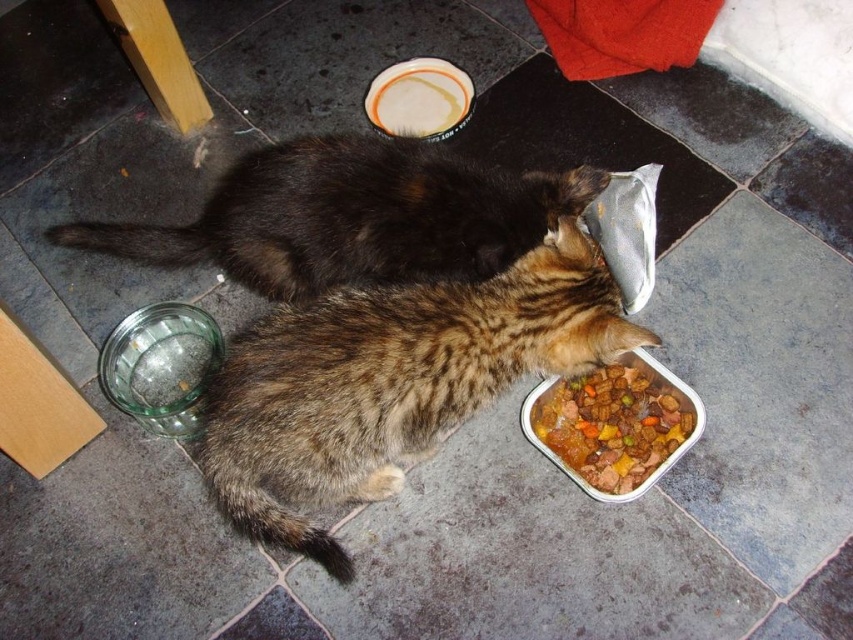
Question: Is dark brown fur cat at center further to the viewer compared to meat and vegetable stew at lower center?

Choices:
 (A) yes
 (B) no

Answer: (A)

Question: Is brown textured fur cat at lower center further to the viewer compared to white glossy plate at upper center?

Choices:
 (A) no
 (B) yes

Answer: (A)

Question: Among these points, which one is farthest from the camera?

Choices:
 (A) (560, 237)
 (B) (535, 392)
 (C) (395, 122)
 (D) (515, 221)

Answer: (C)

Question: Which is farther from the meat and vegetable stew at lower center?

Choices:
 (A) white glossy plate at upper center
 (B) brown textured fur cat at lower center
 (C) dark brown fur cat at center

Answer: (A)

Question: Where is brown textured fur cat at lower center located in relation to meat and vegetable stew at lower center in the image?

Choices:
 (A) above
 (B) below

Answer: (A)

Question: Which point appears farthest from the camera in this image?

Choices:
 (A) (373, 99)
 (B) (608, 480)

Answer: (A)